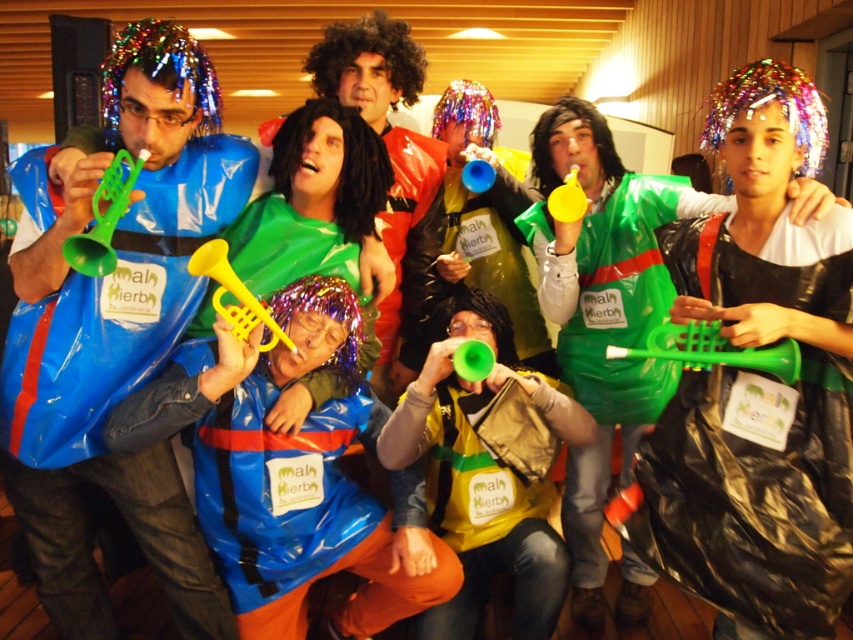
Question: Is green plastic bag at center wider than sparkly metallic wig at center?

Choices:
 (A) yes
 (B) no

Answer: (A)

Question: Among these points, which one is nearest to the camera?

Choices:
 (A) (486, 173)
 (B) (196, 534)

Answer: (B)

Question: Which point appears farthest from the camera in this image?

Choices:
 (A) (132, 164)
 (B) (747, 115)

Answer: (B)

Question: In this image, where is black plastic bag at right located relative to blue plastic trumpet at center?

Choices:
 (A) above
 (B) below

Answer: (B)

Question: Is matte blue life vest at left bigger than curly blonde wig at upper center?

Choices:
 (A) yes
 (B) no

Answer: (A)

Question: Among these objects, which one is farthest from the camera?

Choices:
 (A) sparkly multicolored wig at upper left
 (B) green plastic trumpet at lower right
 (C) green plastic trumpet at left
 (D) matte blue life vest at center

Answer: (A)